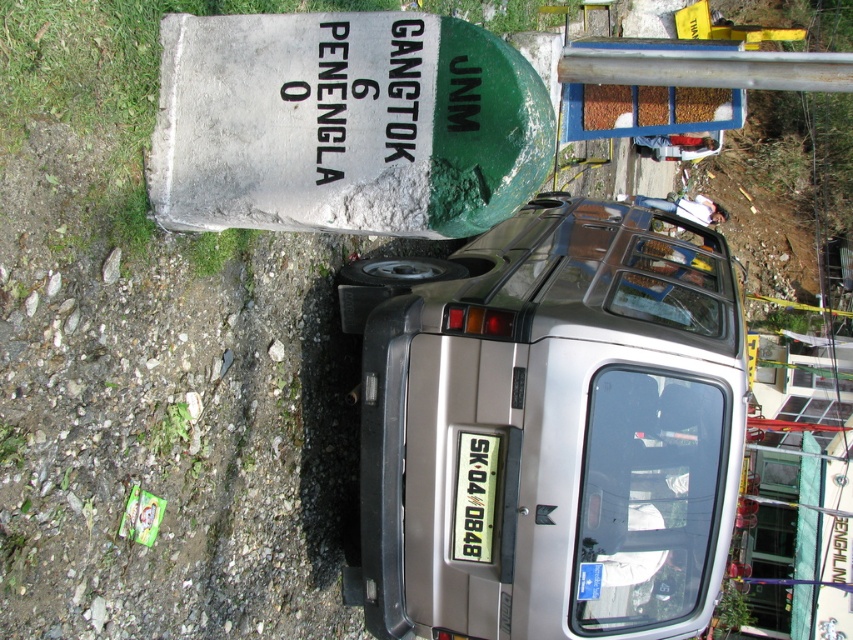
Question: Among these objects, which one is nearest to the camera?

Choices:
 (A) satin silver minivan at center
 (B) white plastic license plate at center

Answer: (A)

Question: Can you confirm if satin silver minivan at center is positioned below white plastic license plate at center?

Choices:
 (A) yes
 (B) no

Answer: (B)

Question: Which point is closer to the camera taking this photo?

Choices:
 (A) (471, 477)
 (B) (532, 512)

Answer: (B)

Question: Is satin silver minivan at center thinner than white plastic license plate at center?

Choices:
 (A) yes
 (B) no

Answer: (B)

Question: Does satin silver minivan at center have a larger size compared to white plastic license plate at center?

Choices:
 (A) no
 (B) yes

Answer: (B)